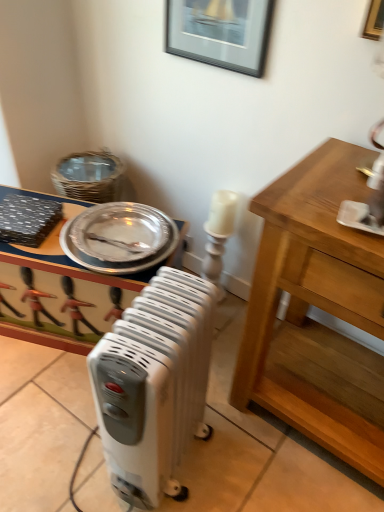
Locate an element on the screen. The height and width of the screenshot is (512, 384). free point below white plastic radiator at center (from a real-world perspective) is located at coordinates (183, 466).